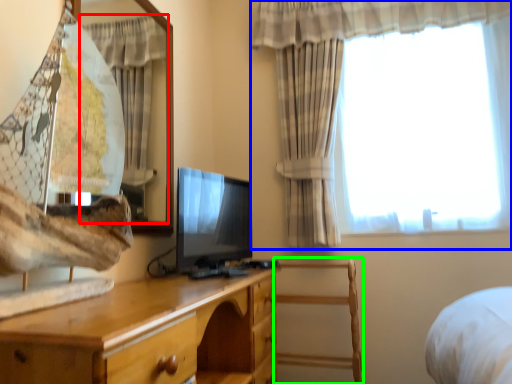
Question: Which object is the closest to the curtain (highlighted by a red box)? Choose among these: curtain (highlighted by a blue box) or chair (highlighted by a green box).

Choices:
 (A) curtain
 (B) chair

Answer: (A)